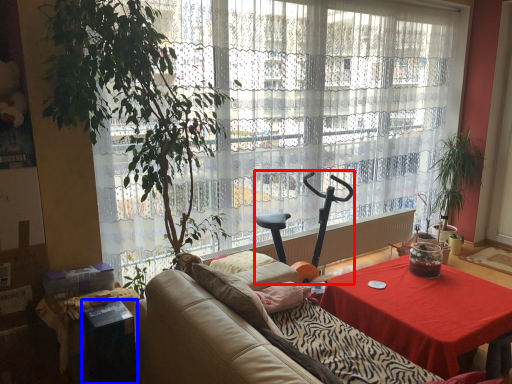
Question: Which object appears farthest to the camera in this image, swivel chair (highlighted by a red box) or cocktail table (highlighted by a blue box)?

Choices:
 (A) swivel chair
 (B) cocktail table

Answer: (A)